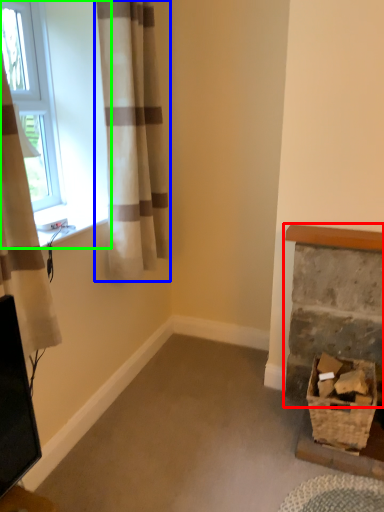
Question: Estimate the real-world distances between objects in this image. Which object is farther from fireplace (highlighted by a red box), curtain (highlighted by a blue box) or window (highlighted by a green box)?

Choices:
 (A) curtain
 (B) window

Answer: (B)